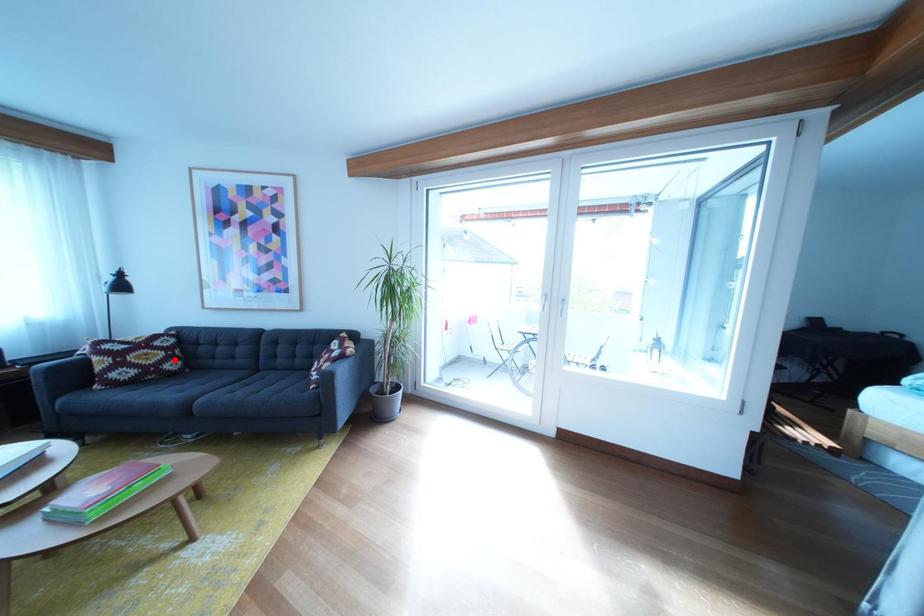
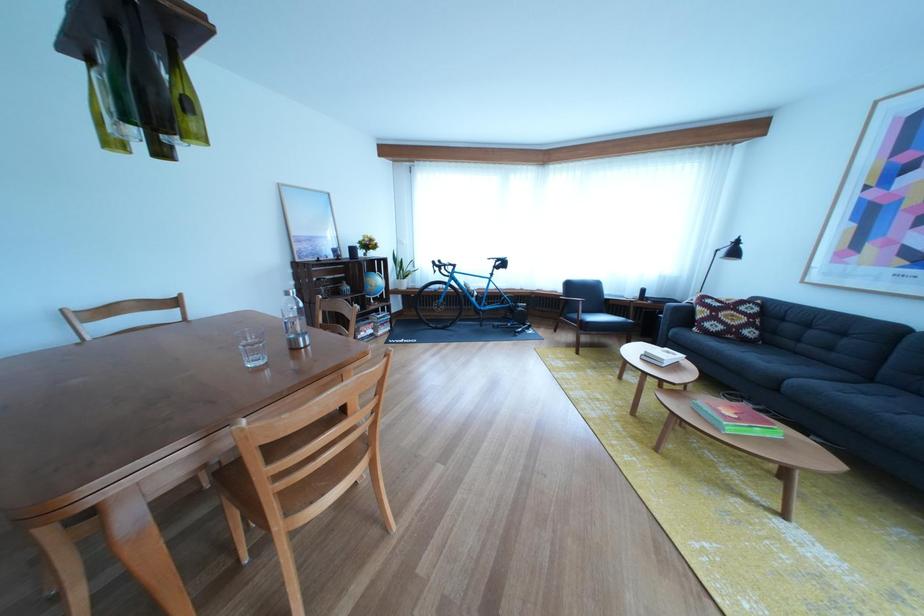
Question: I am providing you with two images of the same scene from different viewpoints. In image1, a red point is highlighted. Considering the same 3D point in image2, which of the following is correct?

Choices:
 (A) It is closer
 (B) It is farther

Answer: (B)